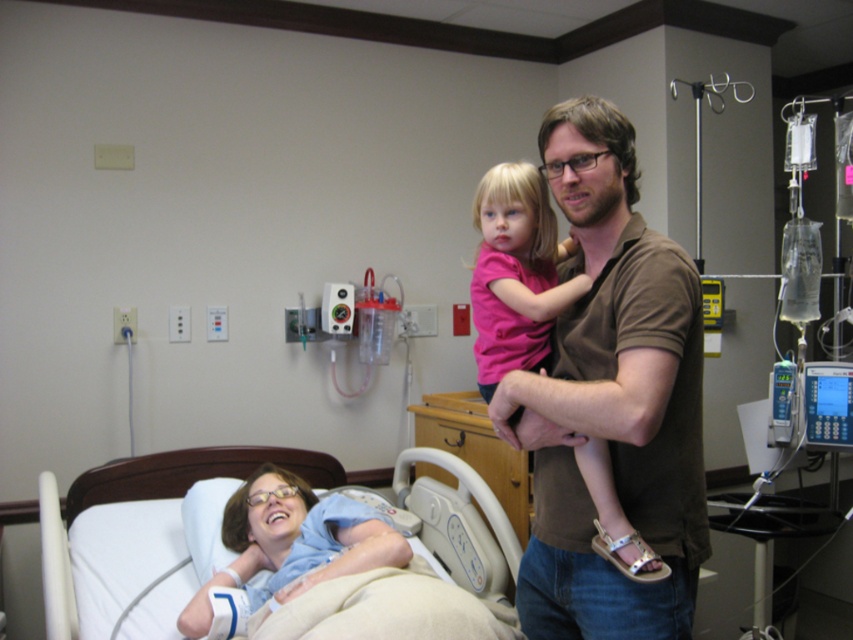
You are a hospital staff member who needs to choose a shirt to cover a medical device. The brown cotton shirt at center and the blue cotton shirt at lower left are available. Which shirt is more suitable if the device requires a thinner material?

The brown cotton shirt at center is thinner than the blue cotton shirt at lower left, so it is more suitable for covering the medical device that requires a thinner material.

You are a hospital staff member who needs to move the brown cotton shirt at center and the white fabric bed at lower left to another room. Considering their sizes, which object will be easier to move?

The brown cotton shirt at center is smaller than the white fabric bed at lower left, so it will be easier to move.